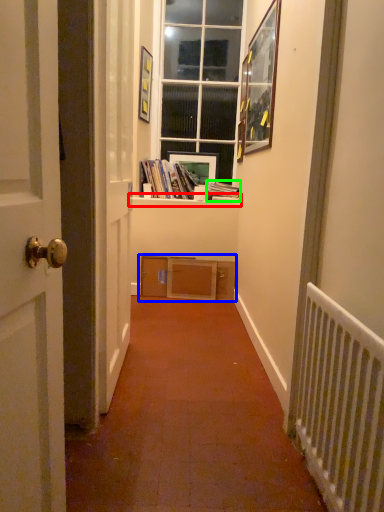
Question: Which object is positioned farthest from window sill (highlighted by a red box)? Select from shelf (highlighted by a blue box) and paperback book (highlighted by a green box).

Choices:
 (A) shelf
 (B) paperback book

Answer: (A)